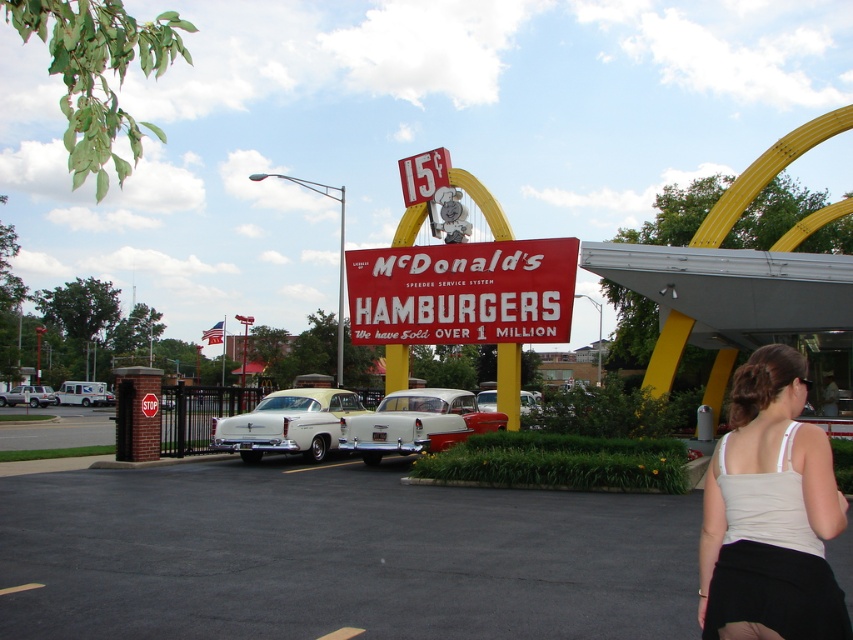
Question: Is red matte sign at center behind white glossy car at center?

Choices:
 (A) no
 (B) yes

Answer: (B)

Question: Which of the following is the closest to the observer?

Choices:
 (A) (24, 401)
 (B) (498, 301)
 (C) (488, 428)

Answer: (C)

Question: Which of the following is the closest to the observer?

Choices:
 (A) (86, 400)
 (B) (492, 429)

Answer: (B)

Question: Does light beige tank top at lower right appear on the left side of red matte sign at center?

Choices:
 (A) yes
 (B) no

Answer: (B)

Question: Can you confirm if red matte sign at center is positioned to the left of matte silver sedan at center?

Choices:
 (A) no
 (B) yes

Answer: (A)

Question: Which of these objects is positioned farthest from the yellow matte car at center?

Choices:
 (A) white glossy car at center
 (B) light beige tank top at lower right
 (C) red matte sign at center
 (D) matte silver sedan at center

Answer: (D)